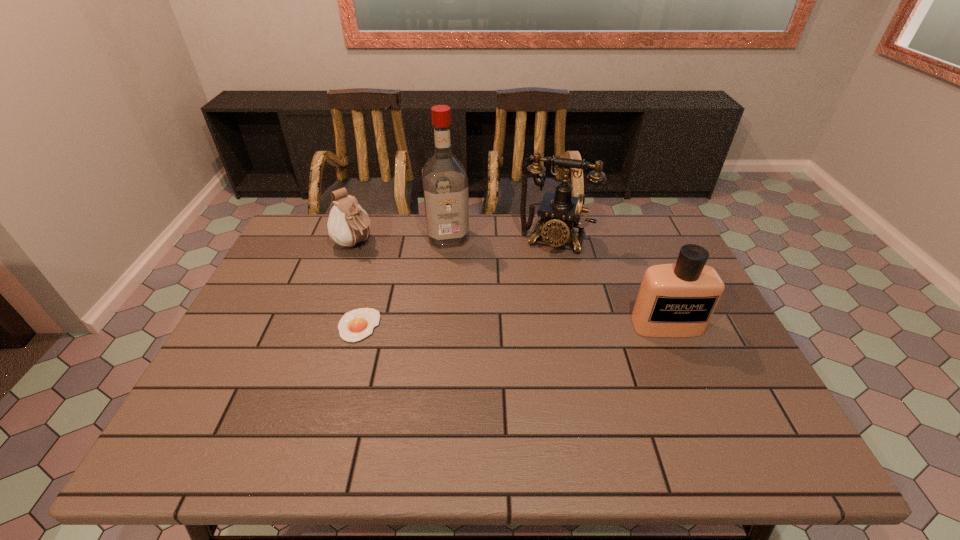
You are a GUI agent. You are given a task and a screenshot of the screen. Output one action in this format:
    pyautogui.click(x=<x>, y=<y>)
    Task: Click on the egg yolk
    The height and width of the screenshot is (540, 960).
    Given the screenshot: What is the action you would take?
    pyautogui.click(x=355, y=325)

Identify the location of perfume. (678, 300).

Find the location of `the third tallest object`. the third tallest object is located at coordinates (678, 300).

Locate an element on the screen. telephone is located at coordinates (560, 212).

This screenshot has width=960, height=540. What are the coordinates of `the second tallest object` in the screenshot? It's located at (560, 212).

Find the location of a particular element. The image size is (960, 540). the tallest object is located at coordinates (445, 184).

At what (x,y) coordinates should I click in order to perform the action: click on liquor. Please return your answer as a coordinate pair (x, y). The height and width of the screenshot is (540, 960). Looking at the image, I should click on (445, 184).

The height and width of the screenshot is (540, 960). Find the location of `pouch`. pouch is located at coordinates (348, 224).

Locate an element on the screen. vacant point located 0.400m on the back of the shortest object is located at coordinates (387, 225).

This screenshot has height=540, width=960. I want to click on vacant space positioned on the front label of the perfume, so click(682, 360).